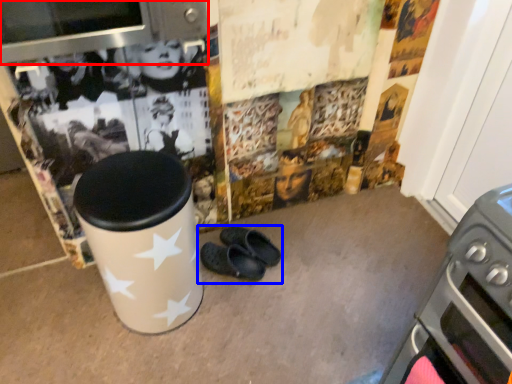
Question: Which object appears farthest to the camera in this image, appliance (highlighted by a red box) or footwear (highlighted by a blue box)?

Choices:
 (A) appliance
 (B) footwear

Answer: (B)